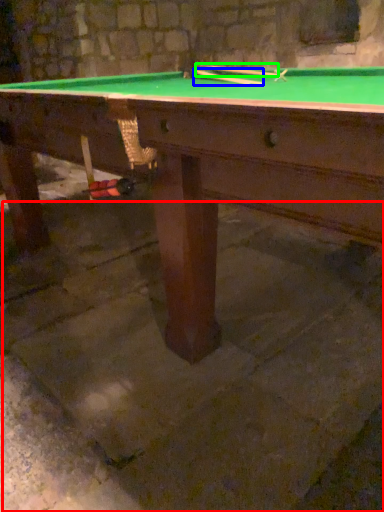
Question: Based on their relative distances, which object is nearer to concrete (highlighted by a red box)? Choose from cue (highlighted by a blue box) and cue (highlighted by a green box).

Choices:
 (A) cue
 (B) cue

Answer: (A)